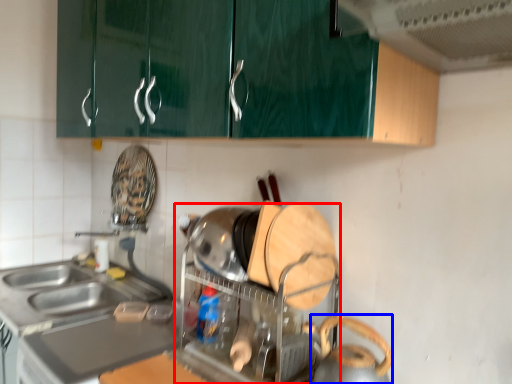
Question: Which point is closer to the camera, appliance (highlighted by a red box) or appliance (highlighted by a blue box)?

Choices:
 (A) appliance
 (B) appliance

Answer: (B)